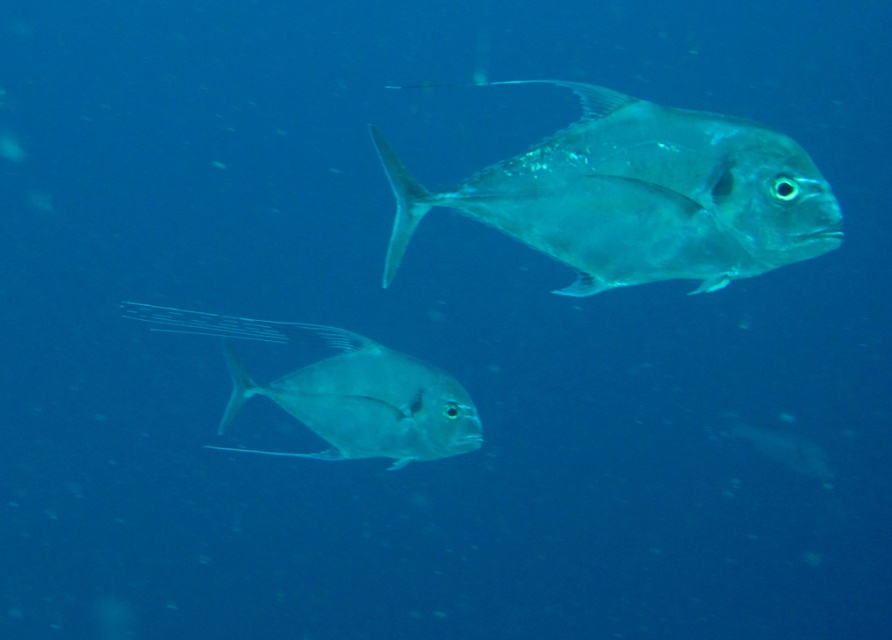
Between translucent silver fish at upper right and translucent silver fish at center, which one appears on the right side from the viewer's perspective?

From the viewer's perspective, translucent silver fish at upper right appears more on the right side.

The image size is (892, 640). Describe the element at coordinates (640, 196) in the screenshot. I see `translucent silver fish at upper right` at that location.

Locate an element on the screen. The height and width of the screenshot is (640, 892). translucent silver fish at upper right is located at coordinates (640, 196).